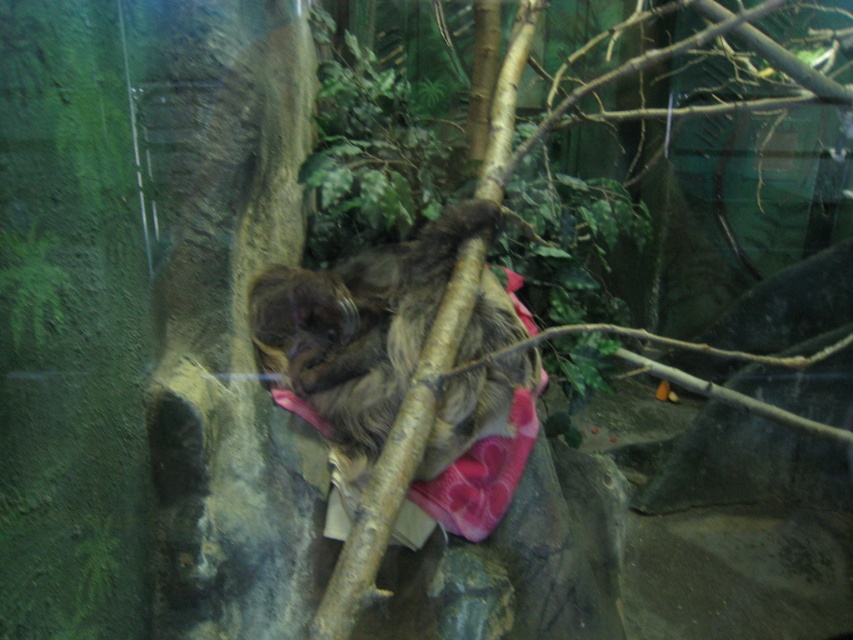
From the picture: You are a zookeeper responsible for the sloth enclosure. You need to place a feeding tray between the brown fuzzy sloth at center and the brown furry tree at center. The tray requires at least 10 inches of space to fit. Can you fit the tray between them?

The distance between the brown fuzzy sloth at center and the brown furry tree at center is 9.18 inches, which is less than the required 10 inches. Therefore, the feeding tray cannot be placed between them.

You are a zookeeper observing the enclosure. Where is the brown fuzzy sloth at center located in the enclosure?

The brown fuzzy sloth at center is located at point [358,324] in the enclosure.